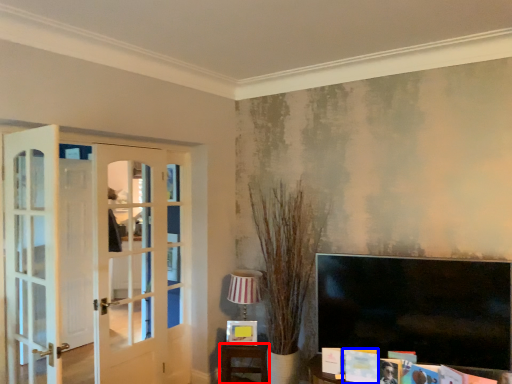
Question: Which object appears farthest to the camera in this image, furniture (highlighted by a red box) or magazine (highlighted by a blue box)?

Choices:
 (A) furniture
 (B) magazine

Answer: (A)